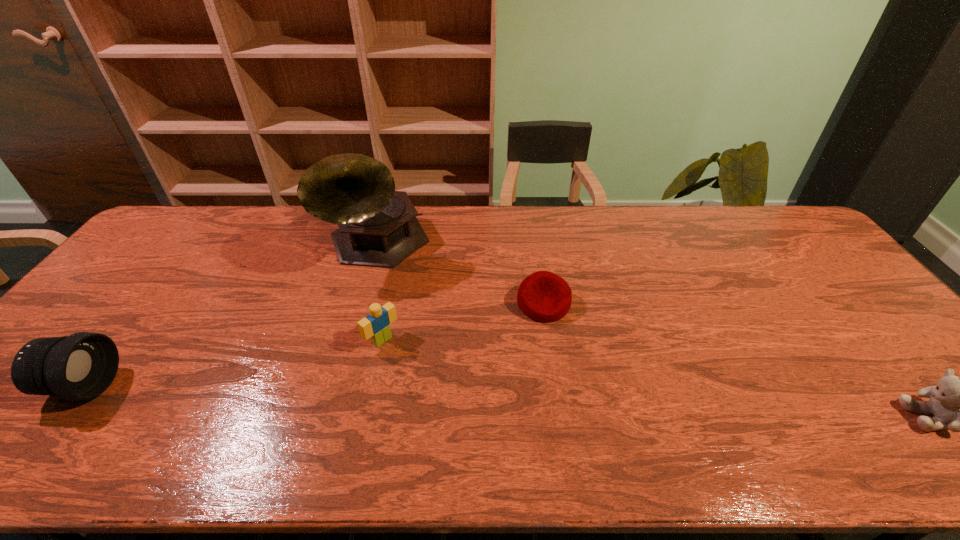
Locate an element on the screen. The height and width of the screenshot is (540, 960). the leftmost object is located at coordinates (81, 366).

I want to click on the fourth shortest object, so click(81, 366).

Where is `beanbag`? beanbag is located at coordinates pyautogui.click(x=543, y=296).

You are a GUI agent. You are given a task and a screenshot of the screen. Output one action in this format:
    pyautogui.click(x=<x>, y=<y>)
    Task: Click on the shortest object
    
    Given the screenshot: What is the action you would take?
    pyautogui.click(x=543, y=296)

Where is `Lego`? Lego is located at coordinates tap(376, 325).

Image resolution: width=960 pixels, height=540 pixels. What are the coordinates of `the tallest object` in the screenshot? It's located at (378, 227).

Identify the location of free region located at the front element of the telephoto lens. The height and width of the screenshot is (540, 960). (243, 386).

Find the location of `free space located on the seat area of the fourth object from left to right`. free space located on the seat area of the fourth object from left to right is located at coordinates (584, 415).

The image size is (960, 540). What are the coordinates of `vacant space located on the seat area of the fourth object from left to right` in the screenshot? It's located at (560, 349).

Where is `blank space located 0.160m on the seat area of the fourth object from left to right`? This screenshot has height=540, width=960. blank space located 0.160m on the seat area of the fourth object from left to right is located at coordinates (568, 372).